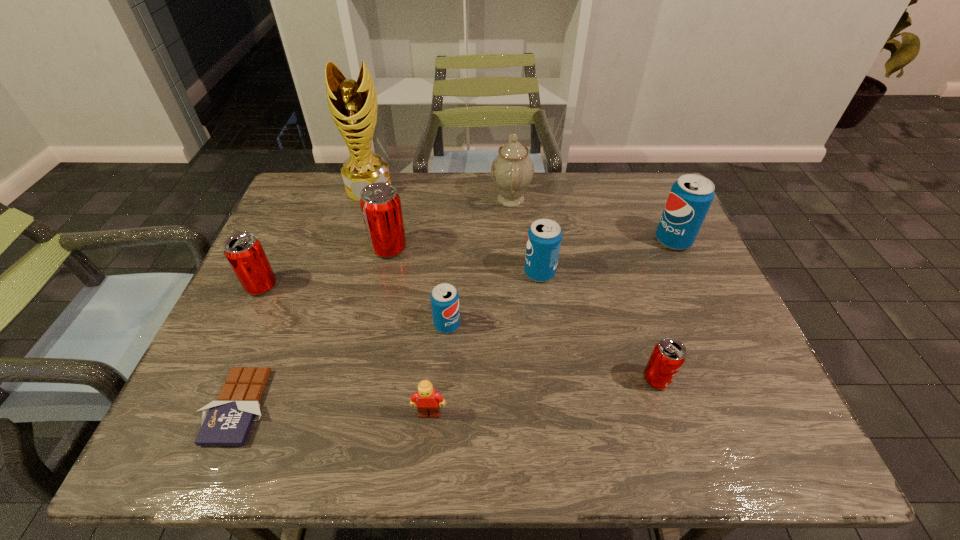
The width and height of the screenshot is (960, 540). I want to click on the closest red soda can to the rightmost object, so click(669, 354).

This screenshot has width=960, height=540. I want to click on vacant space that satisfies the following two spatial constraints: 1. on the front-facing side of the gold award; 2. on the left side of the smallest red soda can, so click(312, 379).

This screenshot has height=540, width=960. In order to click on vacant space that satisfies the following two spatial constraints: 1. on the front side of the smallest blue soda can; 2. on the right side of the second soda can from left to right in this screenshot , I will do `click(373, 325)`.